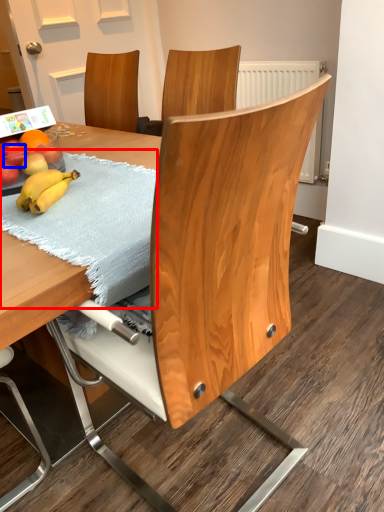
Question: Which object appears closest to the camera in this image, blanket (highlighted by a red box) or apple (highlighted by a blue box)?

Choices:
 (A) blanket
 (B) apple

Answer: (A)